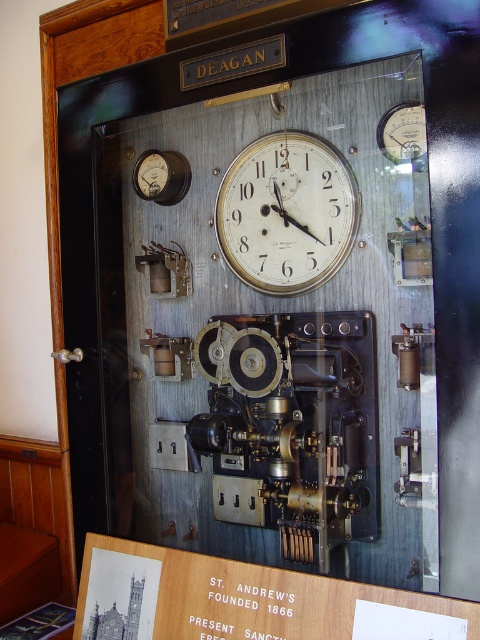
Is white metallic clock at center shorter than matte silver gauge at upper right?

In fact, white metallic clock at center may be taller than matte silver gauge at upper right.

Between white metallic clock at center and matte silver gauge at upper right, which one appears on the right side from the viewer's perspective?

matte silver gauge at upper right

Between point (301, 164) and point (384, 115), which one is positioned in front?

Point (384, 115) is in front.

Find the location of a particular element. white metallic clock at center is located at coordinates (287, 212).